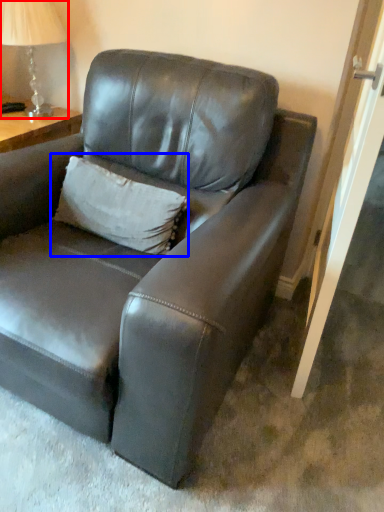
Question: Which point is further to the camera, table lamp (highlighted by a red box) or pillow (highlighted by a blue box)?

Choices:
 (A) table lamp
 (B) pillow

Answer: (A)